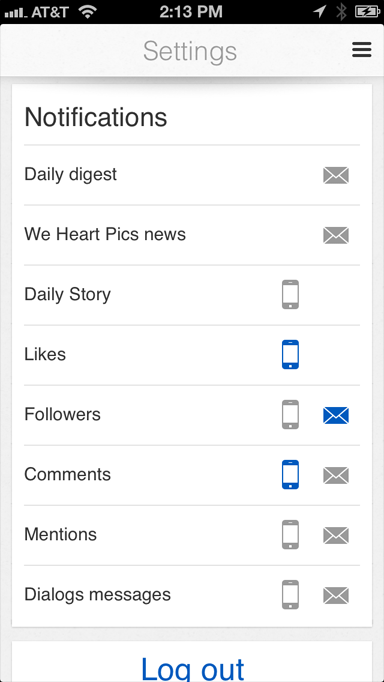
What are the coordinates of `service bars` in the screenshot? It's located at (x=20, y=14).